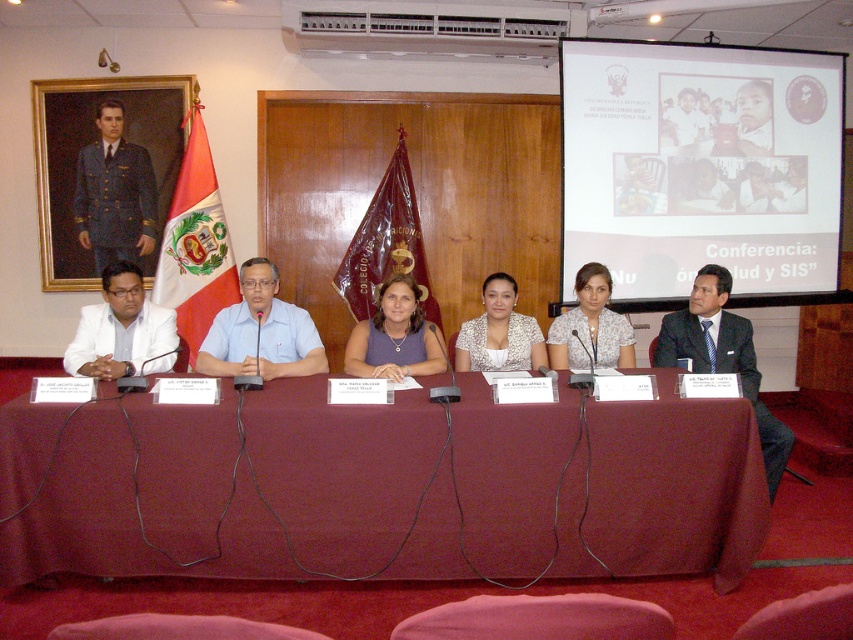
Question: Which point is farther to the camera?

Choices:
 (A) white lace blouse at center
 (B) maroon fabric table at center
 (C) light blue shirt at center
 (D) white matte suit at left

Answer: (A)

Question: From the image, what is the correct spatial relationship of floral fabric blouse at center in relation to white lace blouse at center?

Choices:
 (A) above
 (B) below

Answer: (A)

Question: Which of the following is the closest to the observer?

Choices:
 (A) (241, 372)
 (B) (492, 320)

Answer: (A)

Question: Does matte black uniform at left have a lesser width compared to matte white blouse at center?

Choices:
 (A) yes
 (B) no

Answer: (B)

Question: Does maroon fabric flag at center have a greater width compared to white matte suit at left?

Choices:
 (A) no
 (B) yes

Answer: (B)

Question: Which point appears farthest from the camera in this image?

Choices:
 (A) (483, 349)
 (B) (376, 332)
 (C) (137, 148)
 (D) (820, 129)

Answer: (C)